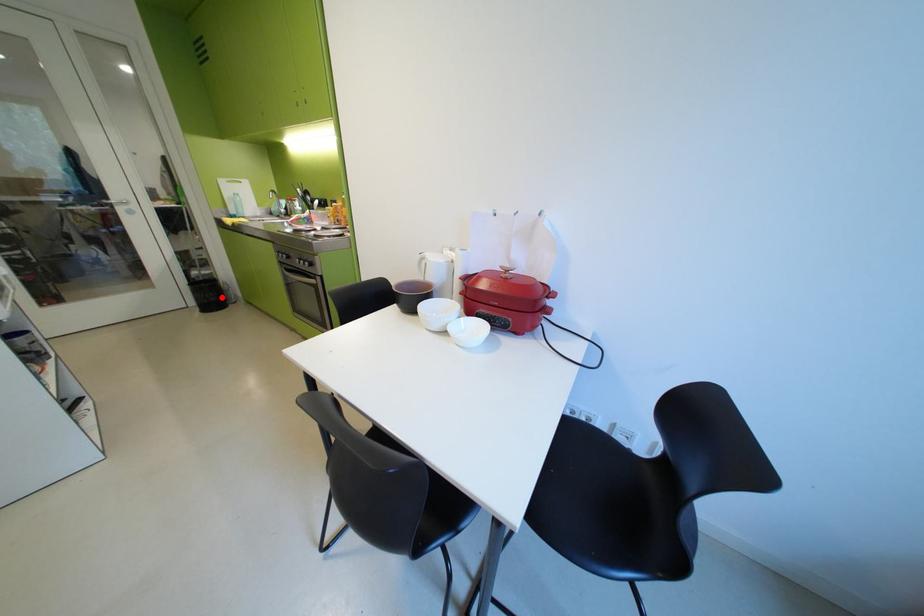
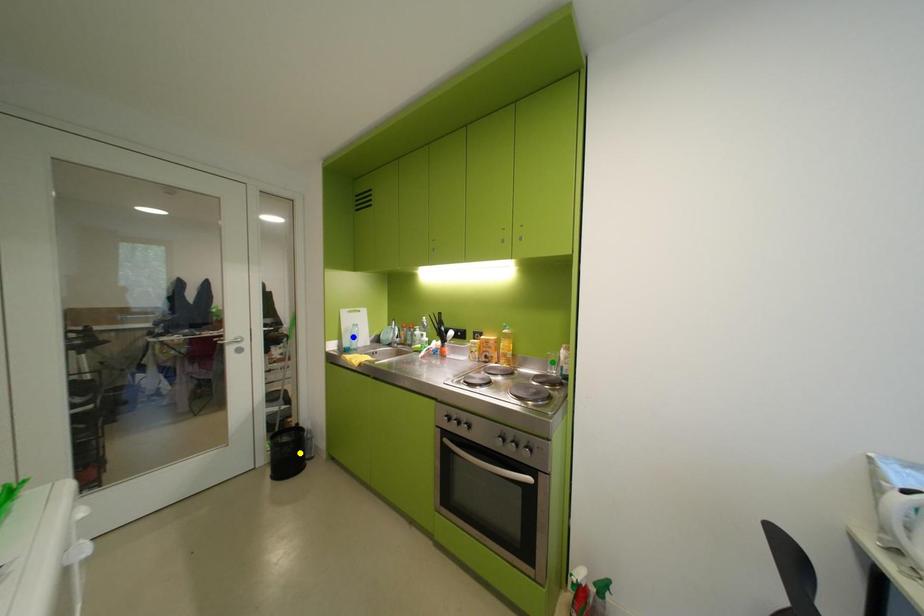
Question: I am providing you with two images of the same scene from different viewpoints. A red point is marked on the first image. You are given multiple points on the second image. Which spot in image 2 lines up with the point in image 1?

Choices:
 (A) green point
 (B) yellow point
 (C) blue point

Answer: (B)